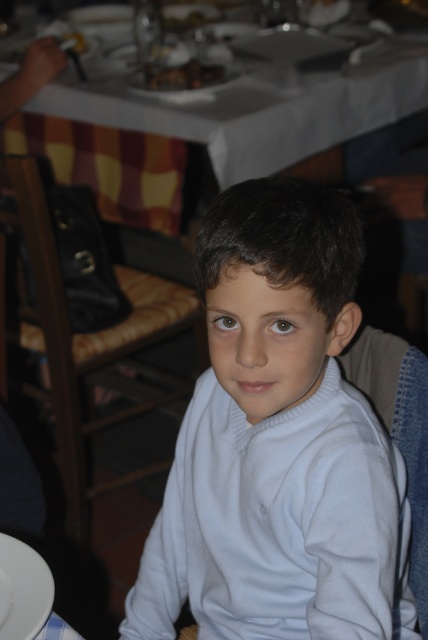
Is white woolen sweater at center to the right of white glossy plate at lower left from the viewer's perspective?

Indeed, white woolen sweater at center is positioned on the right side of white glossy plate at lower left.

The width and height of the screenshot is (428, 640). What are the coordinates of `white woolen sweater at center` in the screenshot? It's located at (279, 444).

Is white woolen sweater at center closer to the viewer compared to white tablecloth at upper center?

Yes, white woolen sweater at center is closer to the viewer.

Where is `white woolen sweater at center`? Image resolution: width=428 pixels, height=640 pixels. white woolen sweater at center is located at coordinates (279, 444).

Does white woolen sweater at center have a larger size compared to golden brown bread at upper center?

Yes, white woolen sweater at center is bigger than golden brown bread at upper center.

Between white woolen sweater at center and golden brown bread at upper center, which one has more height?

white woolen sweater at center

Where is `white woolen sweater at center`? Image resolution: width=428 pixels, height=640 pixels. white woolen sweater at center is located at coordinates (279, 444).